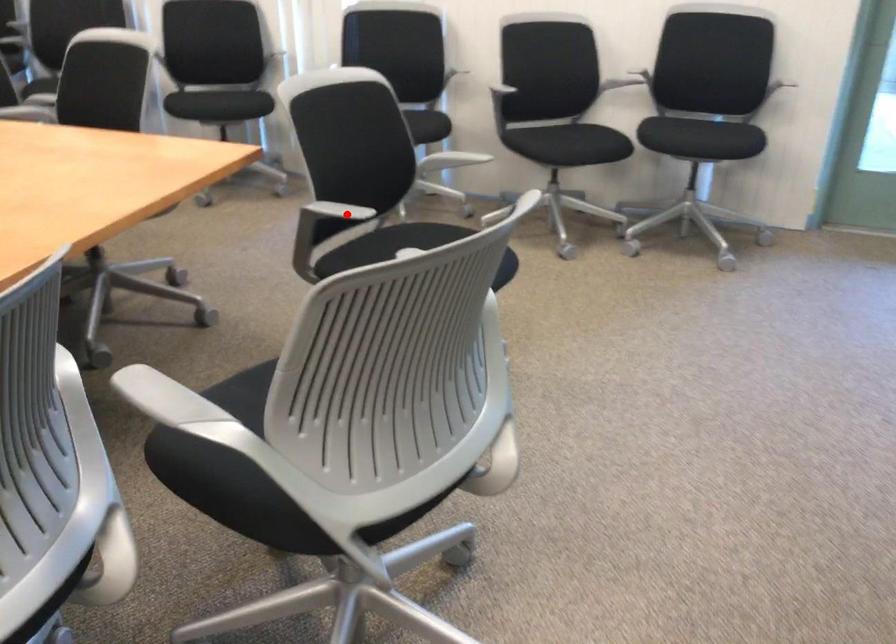
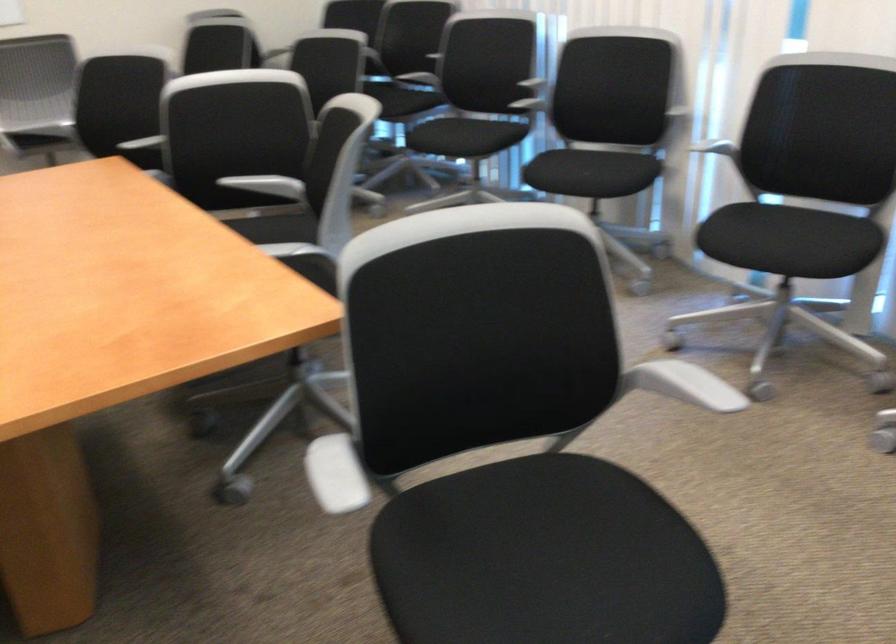
Question: A red point is marked in image1. In image2, is the corresponding 3D point closer to the camera or farther? Reply with the corresponding letter.

Choices:
 (A) The corresponding 3D point is closer.
 (B) The corresponding 3D point is farther.

Answer: (A)